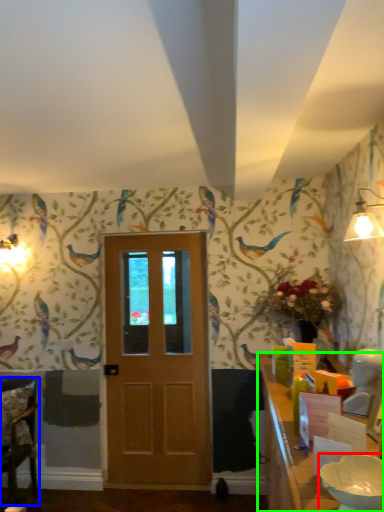
Question: Based on their relative distances, which object is farther from bowl (highlighted by a red box)? Choose from chair (highlighted by a blue box) and table (highlighted by a green box).

Choices:
 (A) chair
 (B) table

Answer: (A)